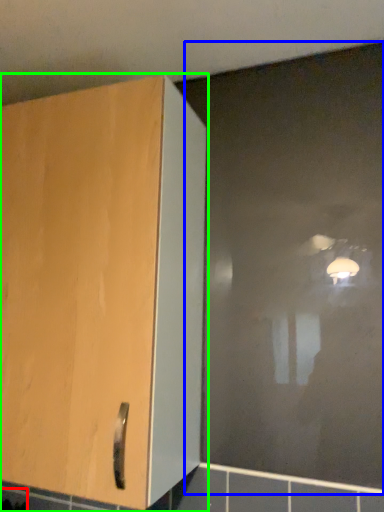
Question: Which object is the farthest from ceramic tile (highlighted by a red box)? Choose among these: glass door (highlighted by a blue box) or cupboard (highlighted by a green box).

Choices:
 (A) glass door
 (B) cupboard

Answer: (A)